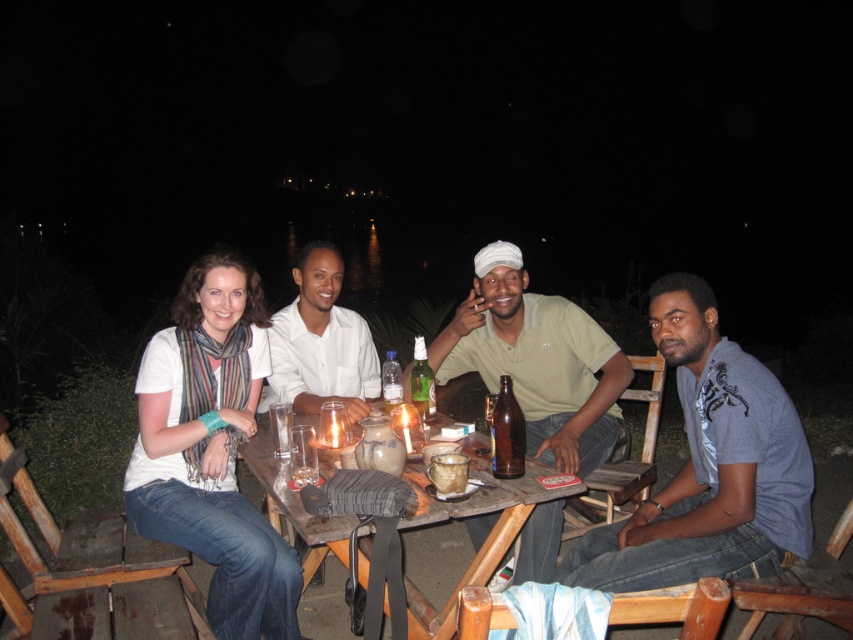
Question: Does light green fabric shirt at center appear over white matte shirt at center?

Choices:
 (A) yes
 (B) no

Answer: (B)

Question: Which of the following is the closest to the observer?

Choices:
 (A) green glass bottle at center
 (B) translucent plastic bottle at center
 (C) wooden table at center
 (D) white matte shirt at center

Answer: (C)

Question: Among these objects, which one is farthest from the camera?

Choices:
 (A) gray cotton t-shirt at lower right
 (B) white matte shirt at center
 (C) wooden table at center

Answer: (B)

Question: Which is nearer to the light green fabric shirt at center?

Choices:
 (A) translucent plastic bottle at center
 (B) brown glass bottle at center

Answer: (A)

Question: Is light green fabric shirt at center wider than translucent plastic bottle at center?

Choices:
 (A) no
 (B) yes

Answer: (B)

Question: Is light green fabric shirt at center to the left of brown glass bottle at center from the viewer's perspective?

Choices:
 (A) yes
 (B) no

Answer: (B)